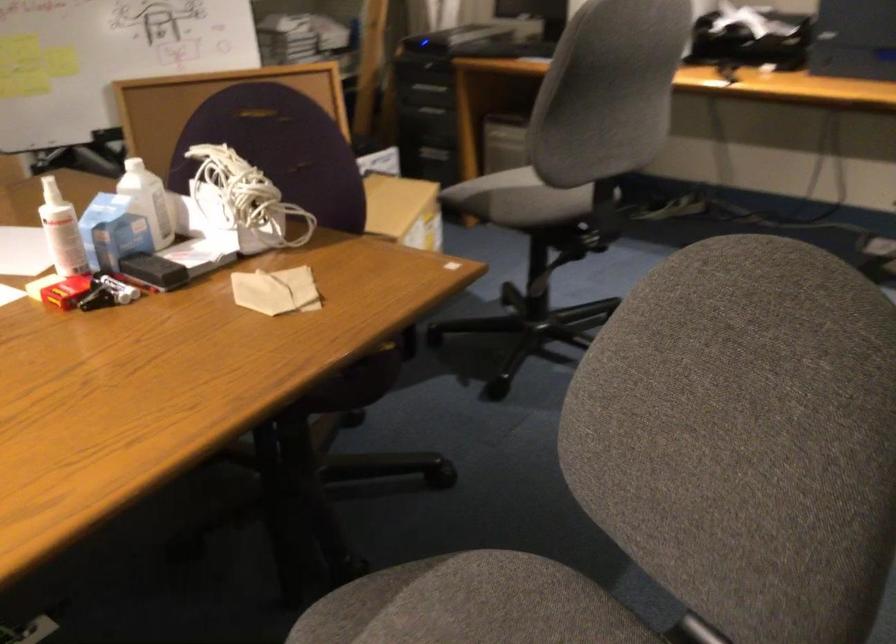
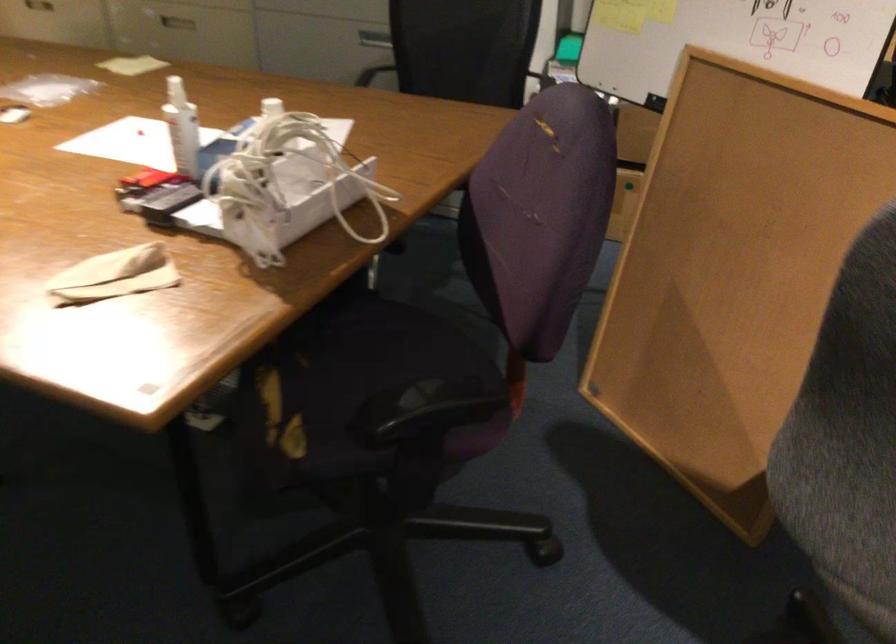
Locate, in the second image, the point that corresponds to (80,220) in the first image.

(182, 128)